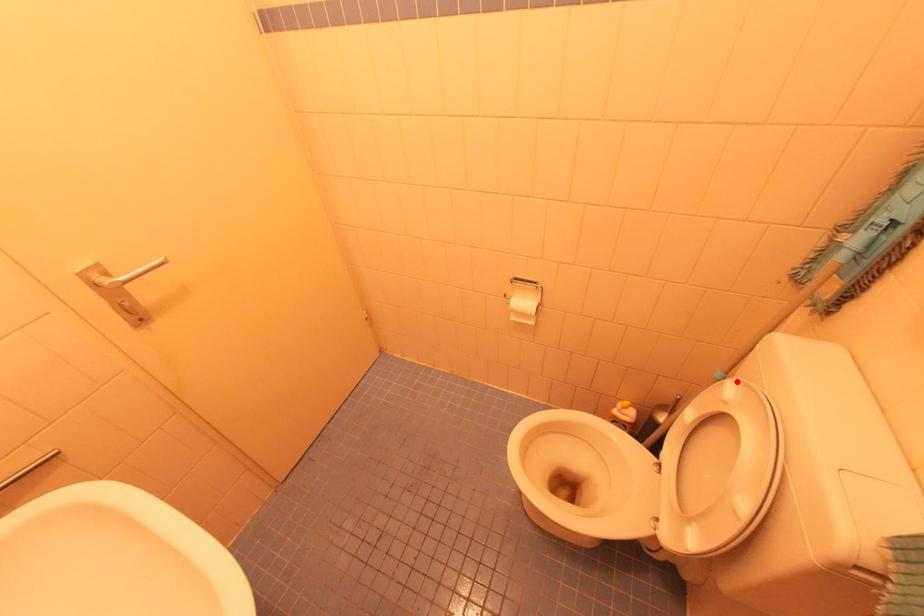
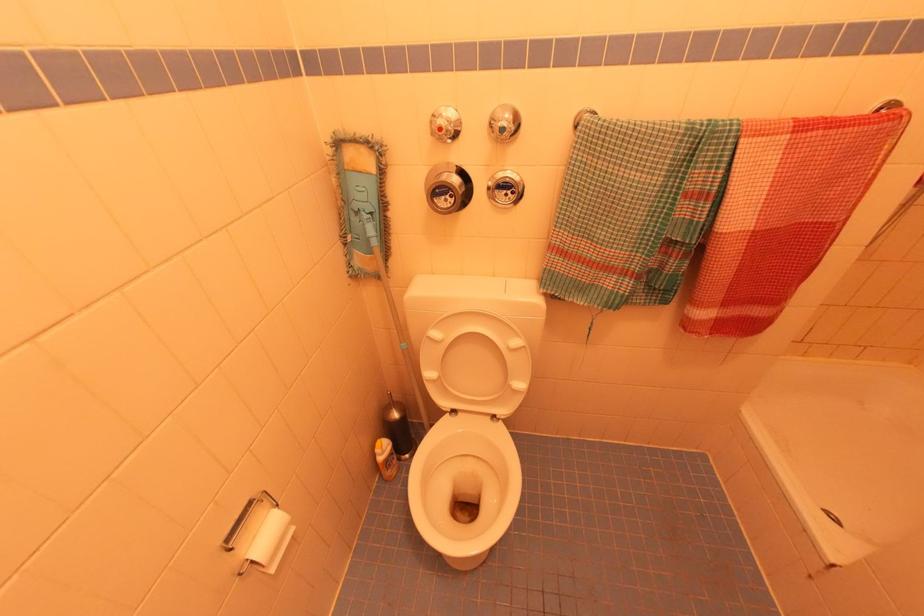
In the second image, find the point that corresponds to the highlighted location in the first image.

(433, 329)